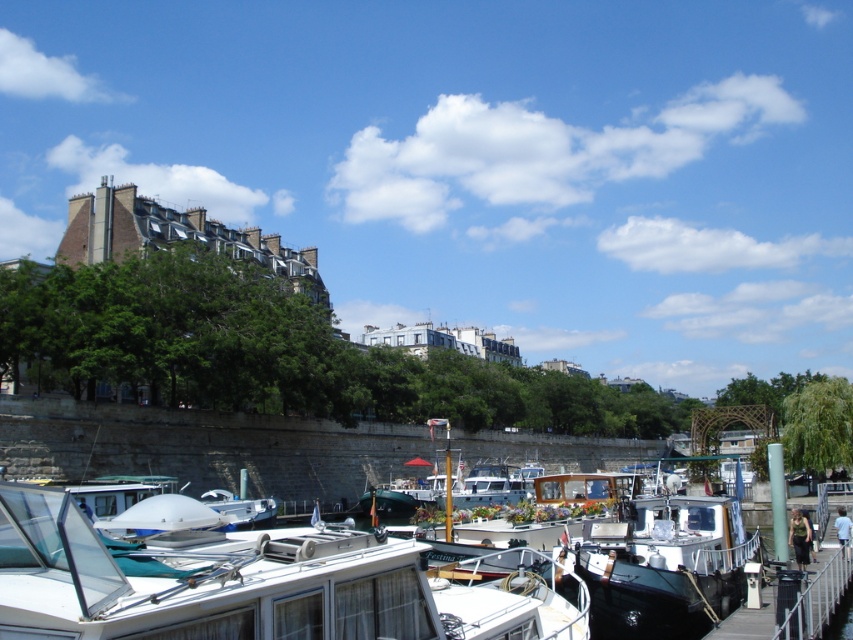
Is point (51, 536) in front of point (729, 532)?

Yes, it is.

Between point (341, 625) and point (706, 600), which one is positioned behind?

Point (706, 600)

Locate an element on the screen. Image resolution: width=853 pixels, height=640 pixels. white glossy boat at center is located at coordinates (248, 580).